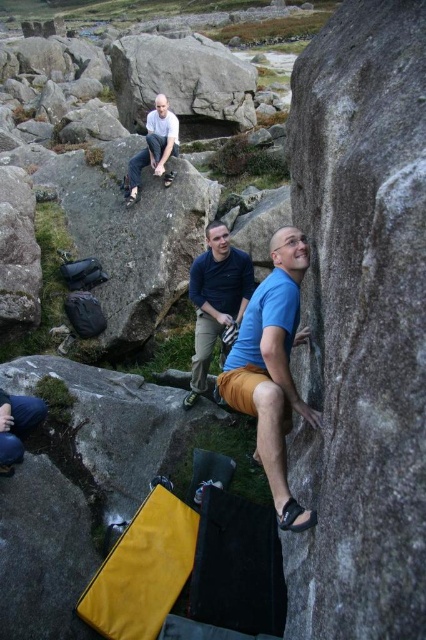
You are a hiker who wants to know which clothing item is narrower between the blue matte shirt at center and the blue fabric pants at center. Which one should you choose?

The blue matte shirt at center is thinner than the blue fabric pants at center, so you should choose the blue matte shirt at center as it is narrower.

You are a hiker who wants to take a photo of the gray rough rock at right and the white matte shirt at upper center. Since you want both objects to appear clearly in the photo, which one should you zoom in on more?

You should zoom in more on the gray rough rock at right because it is bigger than the white matte shirt at upper center, so to capture both clearly, you need to adjust focus to accommodate the larger object.